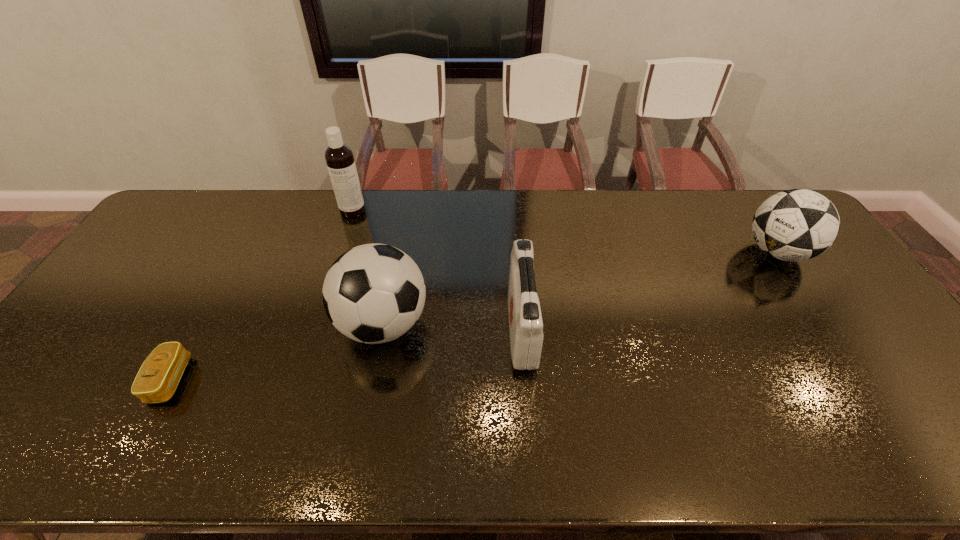
Locate an element on the screen. The width and height of the screenshot is (960, 540). vacant space that satisfies the following two spatial constraints: 1. on the label side of the nearer soccer ball; 2. on the left side of the farthest object is located at coordinates (316, 325).